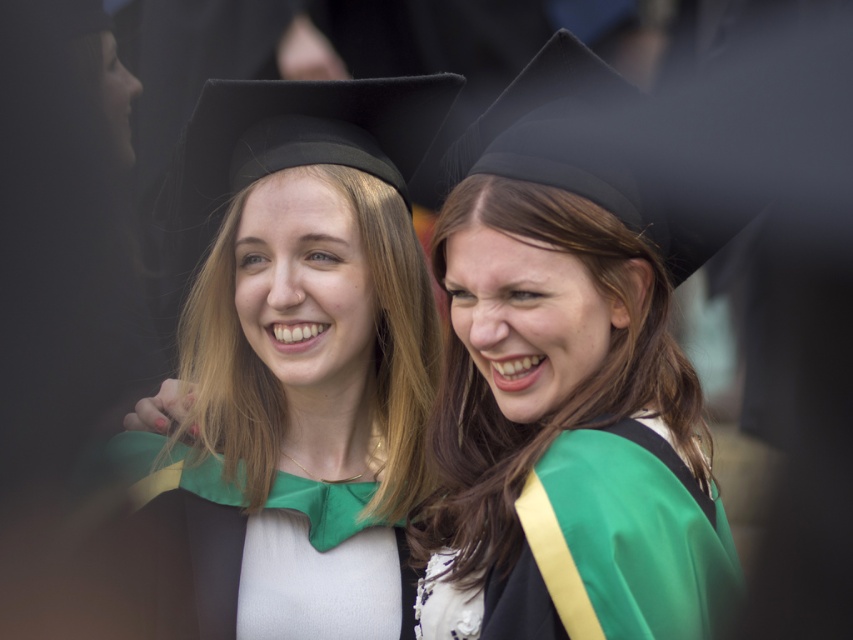
You are a photographer at a graduation ceremony. You want to ensure that the matte black graduation cap at center is centered in your photo. Given that the cap is represented by the point at coordinates point (300, 356), what should you do to center it?

To center the matte black graduation cap at center represented by point (300, 356), you should adjust your camera so that the point aligns with the center of the frame.

You are a photographer at a graduation ceremony. You need to position a light to the left of the matte black graduation cap at center to highlight it. Will the light also illuminate the green satin graduation gown at center?

The green satin graduation gown at center is to the right of the matte black graduation cap at center. Since the light is placed to the left of the cap, the gown is positioned between the cap and the light, so it will be illuminated by the light.

In the scene shown: You are a photographer at a graduation ceremony. You need to fit both the green satin graduation gown at center and the green satin gown at center into a single frame. Which gown should you adjust the camera angle to focus on first to ensure both are visible?

The green satin graduation gown at center has a larger width than the green satin gown at center, so you should focus on the larger gown first to accommodate its size within the frame.